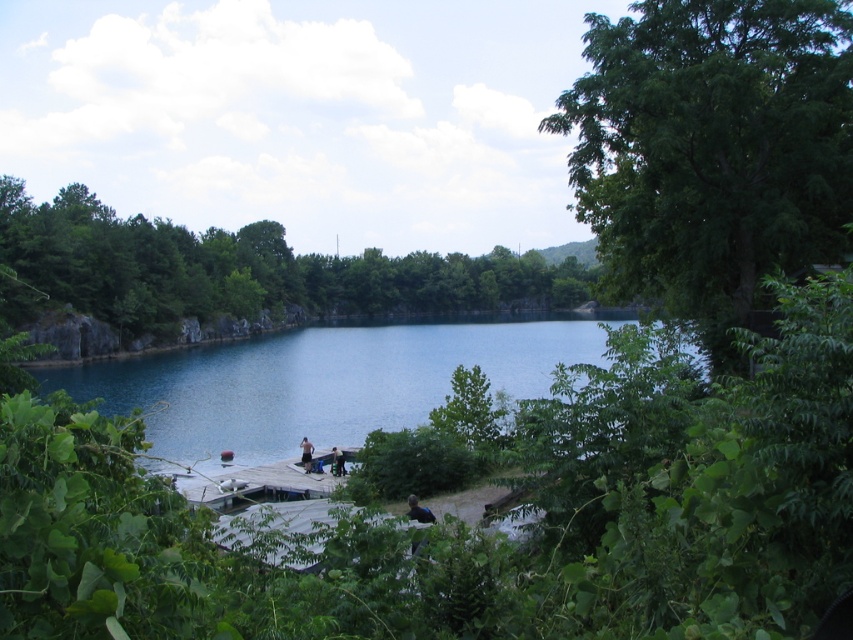
Question: Which point is closer to the camera?

Choices:
 (A) (216, 496)
 (B) (303, 448)
 (C) (368, 392)

Answer: (A)

Question: Can you confirm if blue water at center is bigger than wooden dock at center?

Choices:
 (A) no
 (B) yes

Answer: (B)

Question: Can you confirm if blue water at center is thinner than dark blue shirt at center?

Choices:
 (A) no
 (B) yes

Answer: (A)

Question: Does wooden dock at center appear over dark blue shirt at center?

Choices:
 (A) yes
 (B) no

Answer: (A)

Question: Which object is closer to the camera taking this photo?

Choices:
 (A) blue water at center
 (B) wooden dock at center
 (C) dark blue shirt at center

Answer: (B)

Question: Which object is closer to the camera taking this photo?

Choices:
 (A) blue water at center
 (B) dark blue shirt at center
 (C) wooden dock at center

Answer: (C)